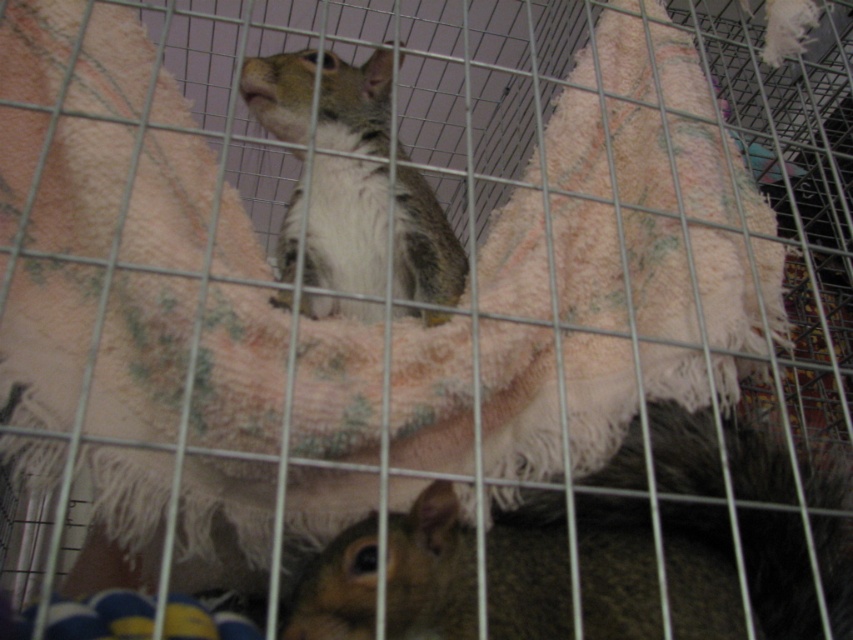
Question: Is brown furry squirrel at lower center above gray-furred squirrel at center?

Choices:
 (A) no
 (B) yes

Answer: (A)

Question: Does brown furry squirrel at lower center have a smaller size compared to gray-furred squirrel at center?

Choices:
 (A) yes
 (B) no

Answer: (A)

Question: Among these points, which one is farthest from the camera?

Choices:
 (A) (448, 224)
 (B) (703, 582)

Answer: (A)

Question: Does brown furry squirrel at lower center have a greater width compared to gray-furred squirrel at center?

Choices:
 (A) yes
 (B) no

Answer: (A)